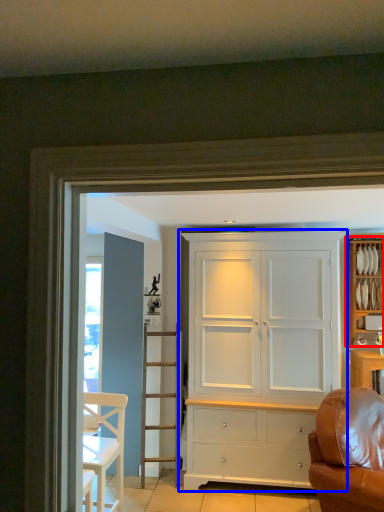
Question: Which of the following is the farthest to the observer, cabinetry (highlighted by a red box) or cupboard (highlighted by a blue box)?

Choices:
 (A) cabinetry
 (B) cupboard

Answer: (A)